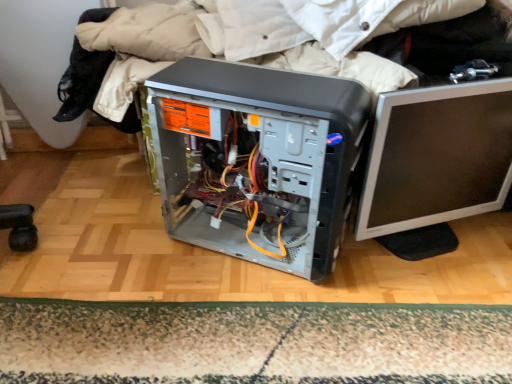
Image resolution: width=512 pixels, height=384 pixels. Find the location of `free area in between satin black computer tower at center and carpeted mat at lower center`. free area in between satin black computer tower at center and carpeted mat at lower center is located at coordinates (220, 276).